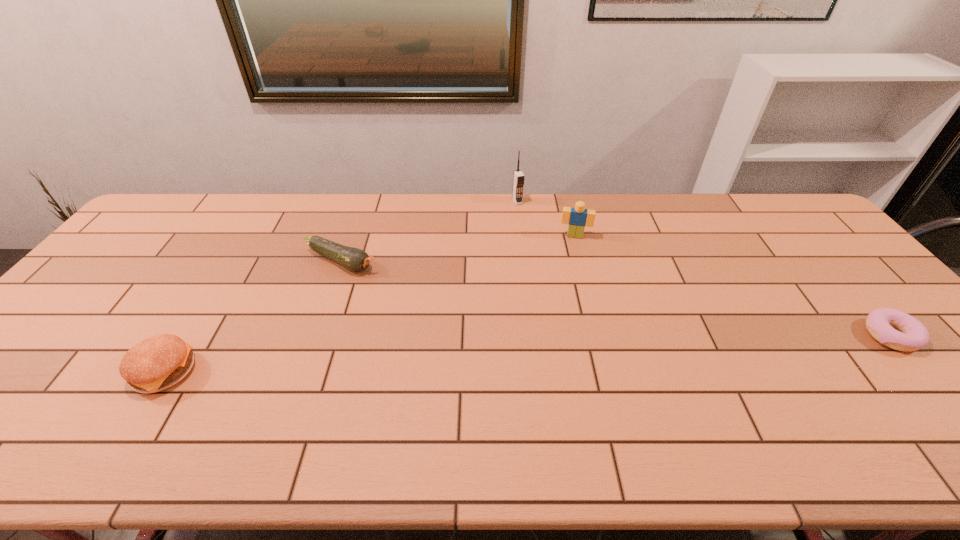
Where is `vacant spot on the desktop that is between the hamburger and the shortest object and is positioned on the front-facing side of the cellular telephone`? Image resolution: width=960 pixels, height=540 pixels. vacant spot on the desktop that is between the hamburger and the shortest object and is positioned on the front-facing side of the cellular telephone is located at coordinates (603, 350).

This screenshot has width=960, height=540. In order to click on free space on the desktop that is between the leftmost object and the shortest object and is positioned at the blossom end of the third farthest object in this screenshot , I will do `click(527, 354)`.

The height and width of the screenshot is (540, 960). What are the coordinates of `vacant spot on the desktop that is between the hamburger and the doughnut and is positioned on the face of the second tallest object` in the screenshot? It's located at (565, 352).